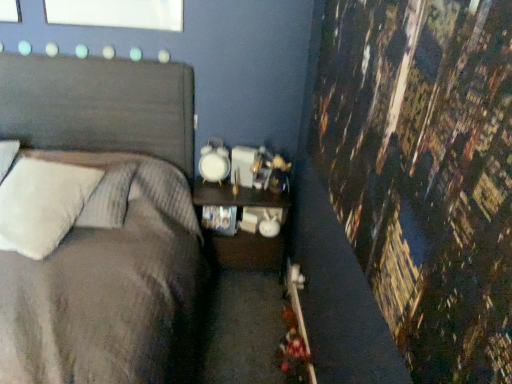
Where is `empty space that is ontop of wooden nightstand at center`? Image resolution: width=512 pixels, height=384 pixels. empty space that is ontop of wooden nightstand at center is located at coordinates (247, 188).